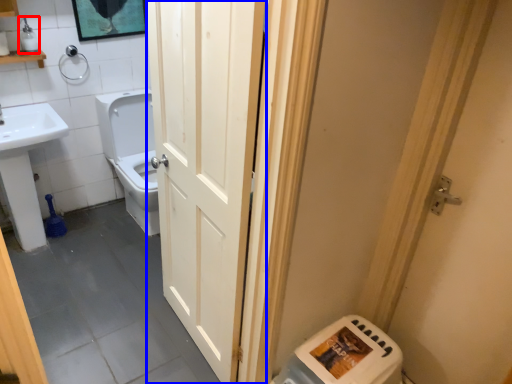
Question: Which of the following is the farthest to the observer, toiletry (highlighted by a red box) or door (highlighted by a blue box)?

Choices:
 (A) toiletry
 (B) door

Answer: (A)